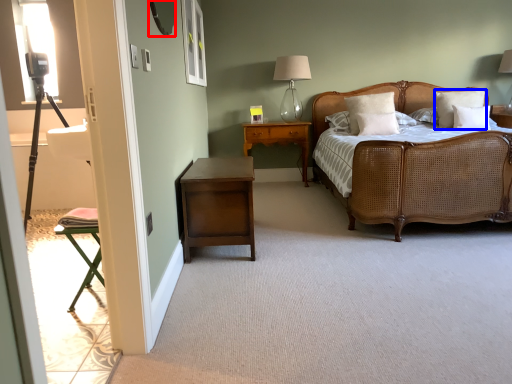
Question: Among these objects, which one is nearest to the camera, mirror (highlighted by a red box) or pillow (highlighted by a blue box)?

Choices:
 (A) mirror
 (B) pillow

Answer: (A)